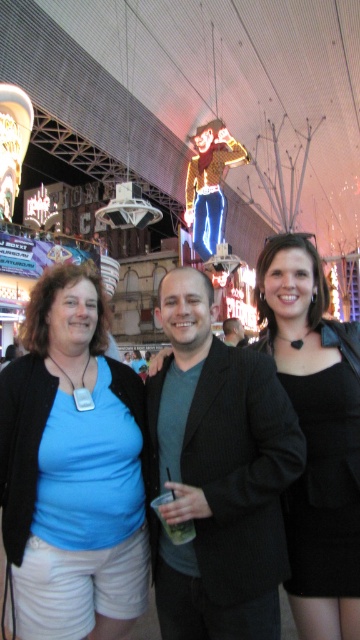
How far apart are matte black jacket at center and black matte dress at center?

matte black jacket at center is 2.51 meters from black matte dress at center.

Who is shorter, matte black jacket at center or black matte dress at center?

black matte dress at center is shorter.

Which is in front, point (196, 280) or point (293, 332)?

Point (196, 280) is more forward.

I want to click on matte black jacket at center, so click(x=251, y=442).

Is matte black jacket at center thinner than black pinstripe suit at center?

No.

Where is `matte black jacket at center`? This screenshot has height=640, width=360. matte black jacket at center is located at coordinates (251, 442).

Locate an element on the screen. Image resolution: width=360 pixels, height=640 pixels. matte black jacket at center is located at coordinates (251, 442).

Is blue fabric shirt at center wider than black pinstripe suit at center?

In fact, blue fabric shirt at center might be narrower than black pinstripe suit at center.

Between blue fabric shirt at center and black pinstripe suit at center, which one is positioned higher?

black pinstripe suit at center is higher up.

Is point (38, 481) in front of point (253, 627)?

No, (38, 481) is further to viewer.

Identify the location of blue fabric shirt at center. (72, 468).